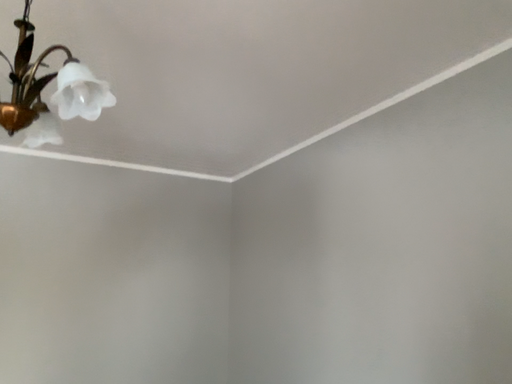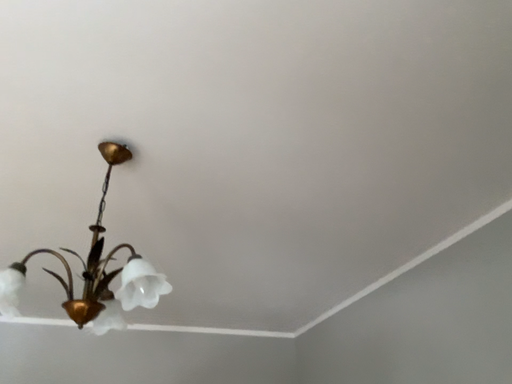
Question: Which way did the camera rotate in the video?

Choices:
 (A) rotated downward
 (B) rotated upward

Answer: (B)